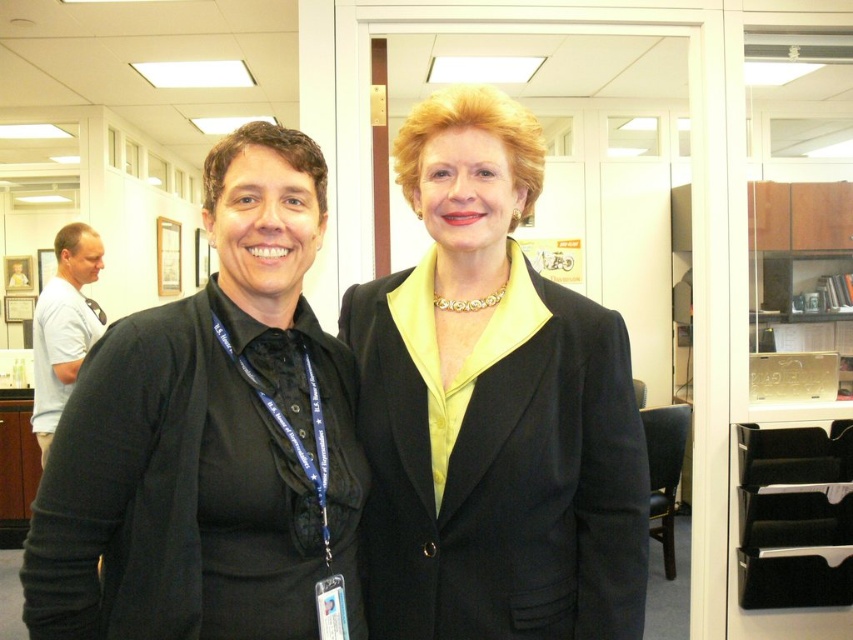
You are a photographer setting up a shoot in an office. You need to ensure that the black matte blazer at left is visible in the final photo. Given that the black satin blazer at center is currently blocking it, what adjustment should you make to the camera angle or subject positioning?

The black matte blazer at left is behind the black satin blazer at center. To make the black matte blazer at left visible, you should move the black satin blazer at center to the side or adjust the camera angle to capture the black matte blazer at left from a different perspective where it is not obstructed.

You are organizing a charity event and need to arrange two black blazers on a display rack. The rack has two hooks labeled left and right. According to the image, which hook should the black satin blazer at center be placed on if you want it to be on the right side of the black matte blazer at left?

The black satin blazer at center should be placed on the right hook because, according to the description, it is positioned on the right side of the black matte blazer at left.

You are a fashion designer observing two blazers in an image. You see the black satin blazer at center and the black matte blazer at left. Which blazer is located higher up in the image?

The black satin blazer at center is located higher up in the image because it is above the black matte blazer at left.